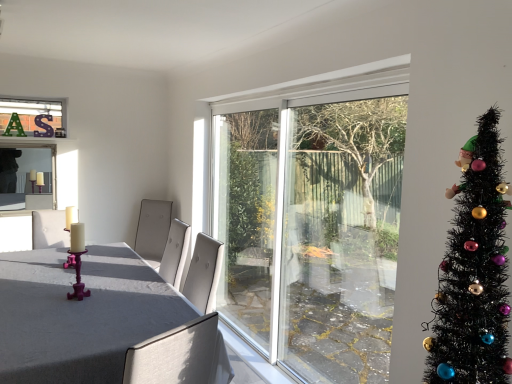
Locate an element on the screen. vacant area that is situated to the right of purple metallic candle holder at left is located at coordinates (106, 298).